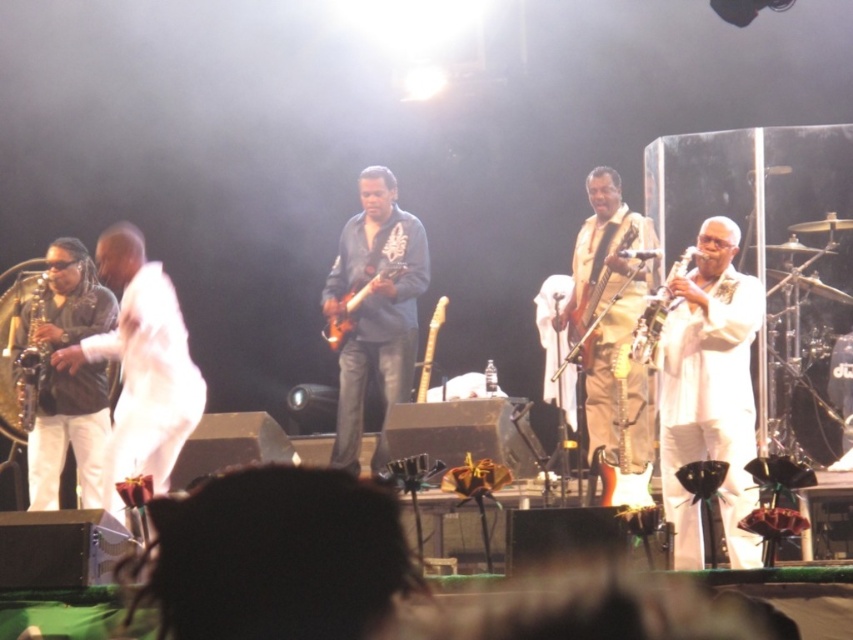
Is white satin suit at center to the left of glossy electric guitar at center from the viewer's perspective?

No, white satin suit at center is not to the left of glossy electric guitar at center.

Where is `white satin suit at center`? This screenshot has width=853, height=640. white satin suit at center is located at coordinates (709, 392).

Locate an element on the screen. white satin suit at center is located at coordinates (709, 392).

Who is taller, matte brown leather jacket at left or wooden flute at center?

matte brown leather jacket at left is taller.

Does matte brown leather jacket at left have a lesser width compared to wooden flute at center?

No, matte brown leather jacket at left is not thinner than wooden flute at center.

The height and width of the screenshot is (640, 853). Identify the location of matte brown leather jacket at left. (141, 365).

What do you see at coordinates (605, 296) in the screenshot? This screenshot has height=640, width=853. I see `satin gold guitar at center` at bounding box center [605, 296].

Is satin gold guitar at center shorter than wooden electric guitar at center?

Incorrect, satin gold guitar at center's height does not fall short of wooden electric guitar at center's.

Is point (608, 372) positioned behind point (579, 339)?

Yes, point (608, 372) is behind point (579, 339).

Where is `satin gold guitar at center`? satin gold guitar at center is located at coordinates (605, 296).